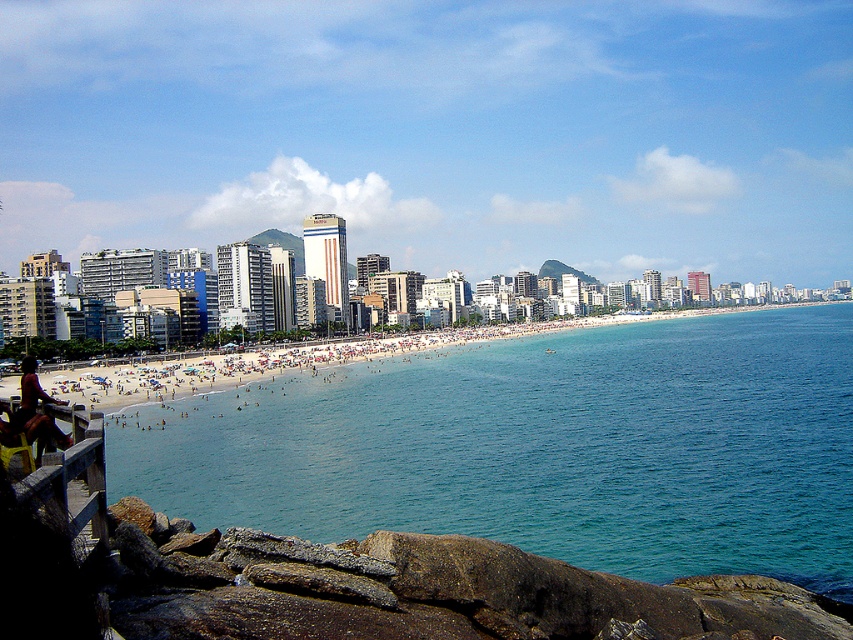
Question: Is clear blue water at center bigger than wooden rail at lower left?

Choices:
 (A) no
 (B) yes

Answer: (B)

Question: Can you confirm if clear blue water at center is positioned below matte black surfboard at lower left?

Choices:
 (A) yes
 (B) no

Answer: (A)

Question: Which object appears farthest from the camera in this image?

Choices:
 (A) matte black surfboard at lower left
 (B) wooden rail at lower left
 (C) clear blue water at center

Answer: (C)

Question: Which point is closer to the camera taking this photo?

Choices:
 (A) (12, 417)
 (B) (64, 412)
 (C) (708, 381)

Answer: (B)

Question: Does clear blue water at center have a smaller size compared to wooden rail at lower left?

Choices:
 (A) no
 (B) yes

Answer: (A)

Question: Which of these objects is positioned closest to the wooden rail at lower left?

Choices:
 (A) matte black surfboard at lower left
 (B) clear blue water at center
 (C) beach sand at center

Answer: (A)